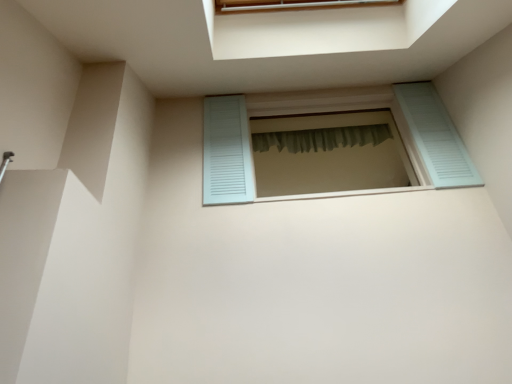
Question: Considering the positions of green sheer curtain at center and light blue wooden window at center in the image, is green sheer curtain at center bigger or smaller than light blue wooden window at center?

Choices:
 (A) small
 (B) big

Answer: (A)

Question: Visually, is green sheer curtain at center positioned to the left or to the right of light blue wooden window at center?

Choices:
 (A) right
 (B) left

Answer: (A)

Question: Is green sheer curtain at center inside the boundaries of light blue wooden window at center, or outside?

Choices:
 (A) inside
 (B) outside

Answer: (B)

Question: Is light blue wooden window at center wider or thinner than green sheer curtain at center?

Choices:
 (A) wide
 (B) thin

Answer: (A)

Question: Considering the positions of light blue wooden window at center and green sheer curtain at center in the image, is light blue wooden window at center taller or shorter than green sheer curtain at center?

Choices:
 (A) tall
 (B) short

Answer: (A)

Question: From the image's perspective, is light blue wooden window at center located above or below green sheer curtain at center?

Choices:
 (A) below
 (B) above

Answer: (A)

Question: Is light blue wooden window at center in front of or behind green sheer curtain at center in the image?

Choices:
 (A) front
 (B) behind

Answer: (A)